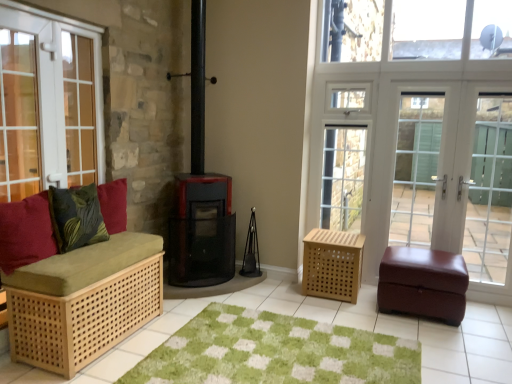
Locate an element on the screen. vacant space to the right of velvety green pillow at left, the 2th pillow viewed from the front is located at coordinates (119, 243).